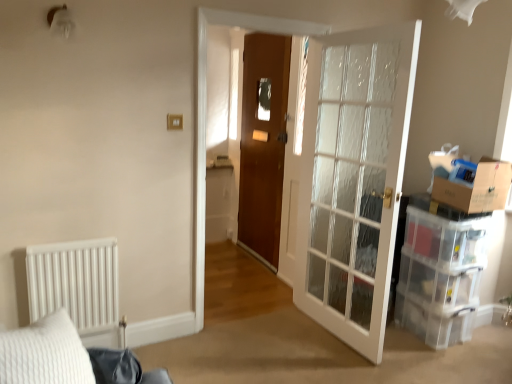
Question: Based on their sizes in the image, would you say clear plastic storage box at right is bigger or smaller than clear glass door at right?

Choices:
 (A) small
 (B) big

Answer: (A)

Question: Do you think clear plastic storage box at right is within clear glass door at right, or outside of it?

Choices:
 (A) inside
 (B) outside

Answer: (B)

Question: Which object is positioned closest to the white matte radiator at left?

Choices:
 (A) wooden door at center
 (B) brown cardboard box at right
 (C) clear plastic storage box at right
 (D) clear plastic drawer at right
 (E) clear glass door at right

Answer: (E)

Question: Estimate the real-world distances between objects in this image. Which object is farther from the clear plastic storage box at right?

Choices:
 (A) brown cardboard box at right
 (B) clear glass door at right
 (C) clear plastic drawer at right
 (D) wooden door at center
 (E) white matte radiator at left

Answer: (E)